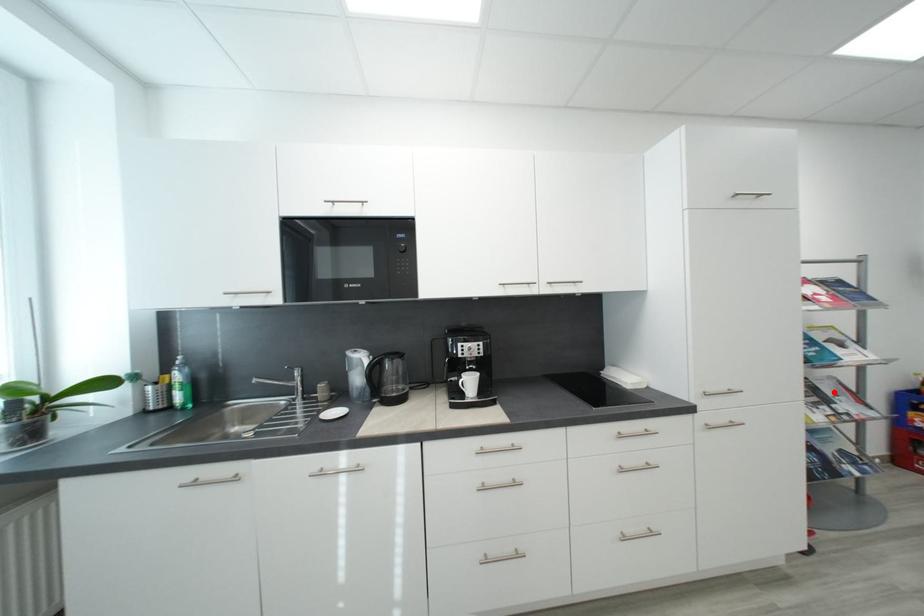
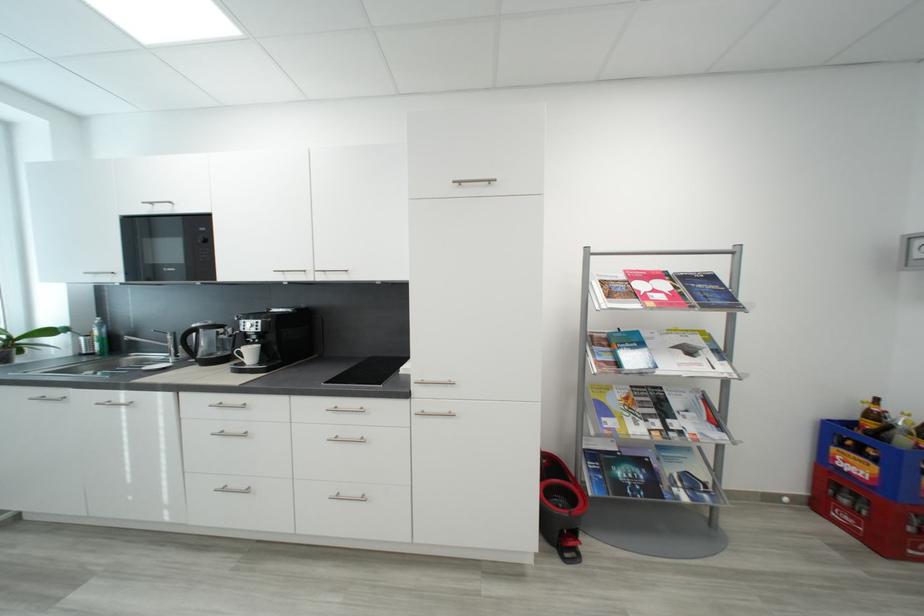
Question: I am providing you with two images of the same scene from different viewpoints. In image1, a red point is highlighted. Considering the same 3D point in image2, which of the following is correct?

Choices:
 (A) It is closer
 (B) It is farther

Answer: (B)